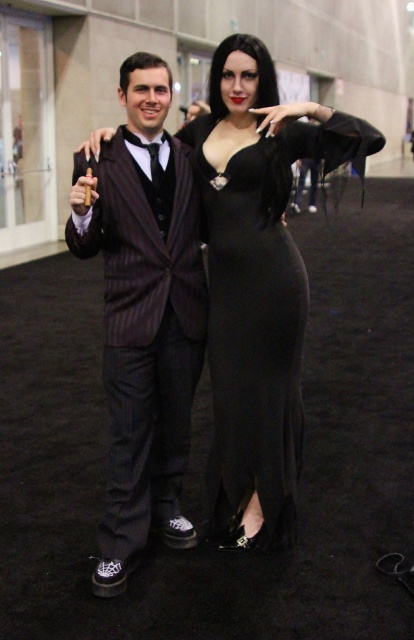
Question: Is pinstriped suit at center positioned behind black satin dress at center?

Choices:
 (A) yes
 (B) no

Answer: (B)

Question: Among these points, which one is nearest to the camera?

Choices:
 (A) (175, 317)
 (B) (226, 170)
 (C) (238, 547)

Answer: (B)

Question: Is matte black dress at center in front of pinstriped suit at center?

Choices:
 (A) no
 (B) yes

Answer: (A)

Question: Does pinstriped suit at center appear on the right side of black satin dress at center?

Choices:
 (A) yes
 (B) no

Answer: (B)

Question: Which point appears closest to the camera in this image?

Choices:
 (A) [262, 221]
 (B) [158, 106]

Answer: (B)

Question: Among these points, which one is nearest to the camera?

Choices:
 (A) (274, 268)
 (B) (308, 106)

Answer: (B)